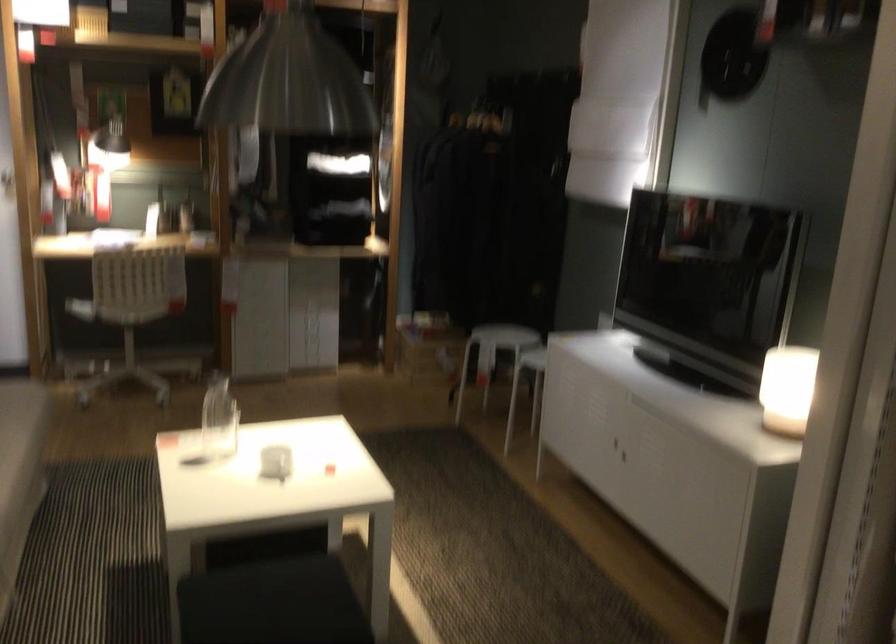
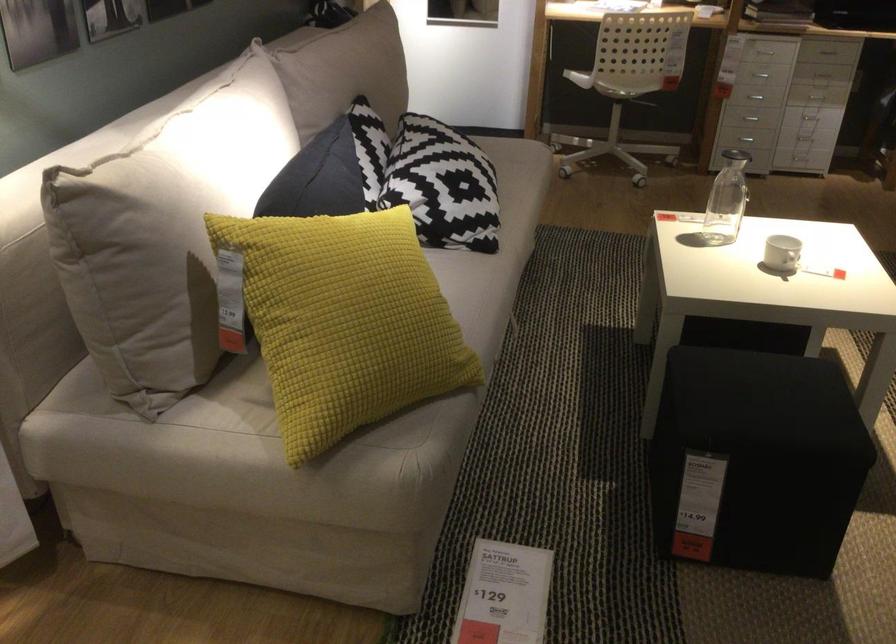
Find the pixel in the second image that matches point 304,321 in the first image.

(815, 96)